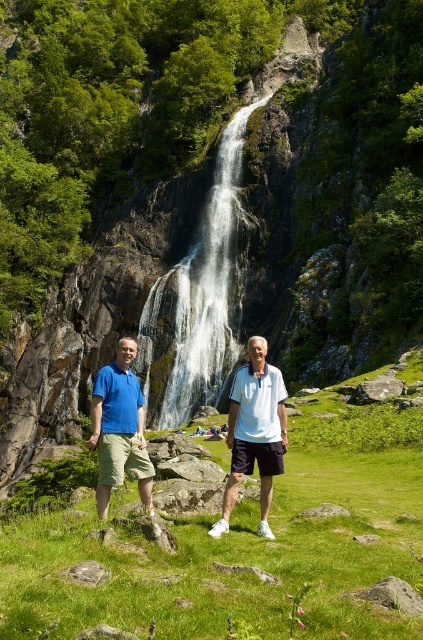
Question: Is green grass at center thinner than white/smooth waterfall at center?

Choices:
 (A) yes
 (B) no

Answer: (B)

Question: Which object appears closest to the camera in this image?

Choices:
 (A) green grass at center
 (B) white/smooth waterfall at center
 (C) blue cotton shirt at center

Answer: (A)

Question: Is green grass at center smaller than white matte shirt at center?

Choices:
 (A) no
 (B) yes

Answer: (A)

Question: Is white/smooth waterfall at center positioned behind white matte shirt at center?

Choices:
 (A) no
 (B) yes

Answer: (B)

Question: Which point is farther to the camera?

Choices:
 (A) (253, 348)
 (B) (104, 408)
 (C) (147, 308)

Answer: (C)

Question: Estimate the real-world distances between objects in this image. Which object is closer to the white matte shirt at center?

Choices:
 (A) blue cotton shirt at center
 (B) green grass at center
 (C) matte blue shirt at center

Answer: (A)